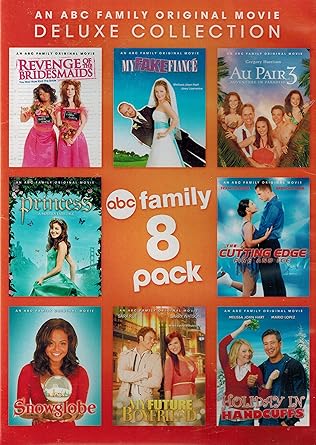
The width and height of the screenshot is (316, 445). I want to click on dvds, so click(61, 141), click(149, 142), click(261, 143), click(83, 255), click(258, 247), click(84, 357), click(165, 329), click(257, 347).